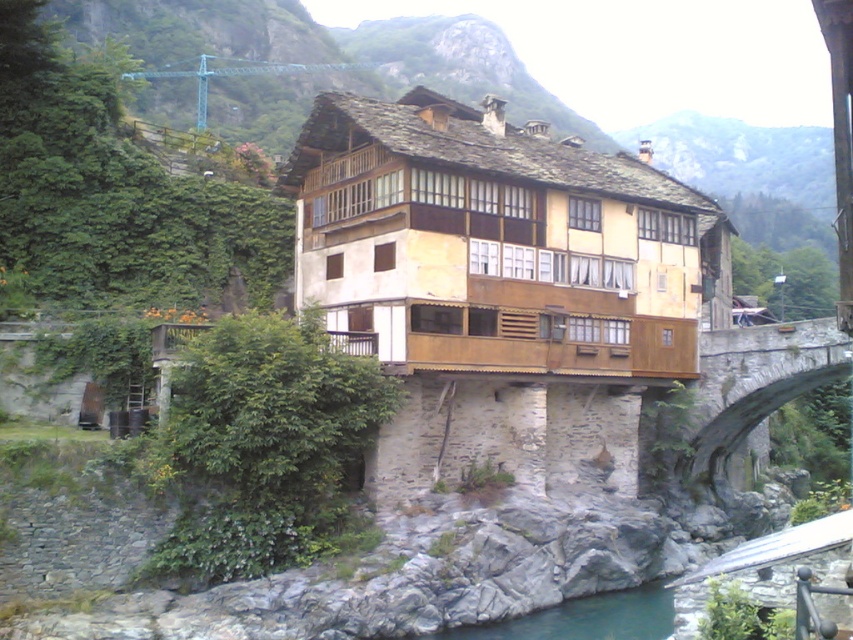
Question: Which point is closer to the camera taking this photo?

Choices:
 (A) pos(640,609)
 (B) pos(779,369)

Answer: (A)

Question: Which of the following is the farthest from the observer?

Choices:
 (A) (845, 362)
 (B) (633, 621)

Answer: (A)

Question: Does stone arch bridge at right have a greater width compared to green stone river at lower center?

Choices:
 (A) no
 (B) yes

Answer: (A)

Question: From the image, what is the correct spatial relationship of stone arch bridge at right in relation to green stone river at lower center?

Choices:
 (A) left
 (B) right

Answer: (B)

Question: Which object appears closest to the camera in this image?

Choices:
 (A) green stone river at lower center
 (B) stone arch bridge at right

Answer: (A)

Question: Does stone arch bridge at right appear under green stone river at lower center?

Choices:
 (A) yes
 (B) no

Answer: (B)